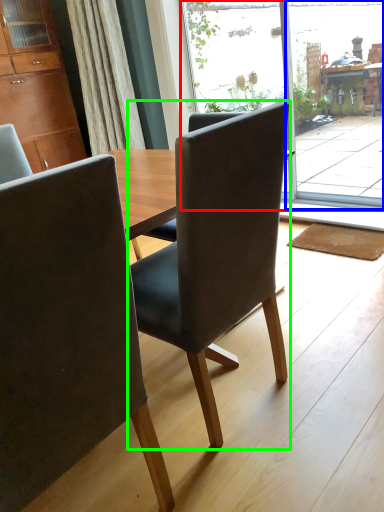
Question: Which object is positioned farthest from glass door (highlighted by a red box)? Select from screen door (highlighted by a blue box) and chair (highlighted by a green box).

Choices:
 (A) screen door
 (B) chair

Answer: (B)